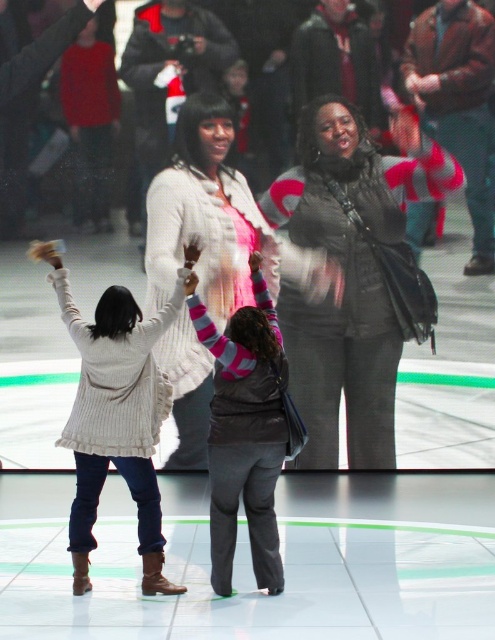
You are a photographer trying to capture a photo of the gray fuzzy vest at center while ensuring the white knit sweater at center is still visible in the frame. Is it possible to do so without moving either object?

Yes, since the gray fuzzy vest at center is behind the white knit sweater at center, you can position the camera so that the white knit sweater at center is in front but still allows the gray fuzzy vest at center to be visible behind it in the photo.

Based on the photo, you are an event organizer planning to place two large banners behind the matte black vest at center and the white knit sweater at center. Since the banners need to be proportional to the objects, which banner should be smaller?

The banner for the matte black vest at center should be smaller because it occupies less space than the white knit sweater at center.